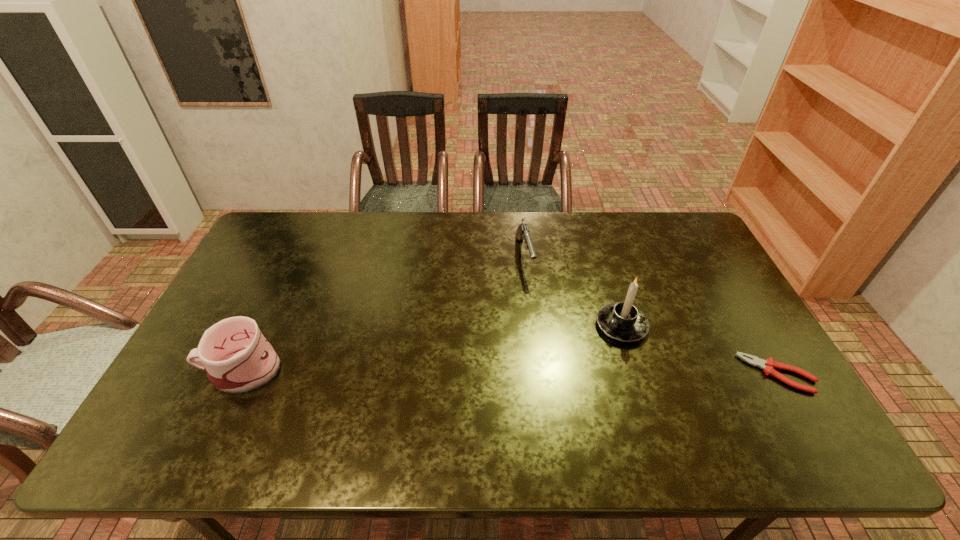
Identify the location of vacant space on the desktop that is between the second tallest object and the rightmost object and is positioned with a handle on the side of the third object from left to right. (558, 372).

The width and height of the screenshot is (960, 540). Find the location of `vacant spot on the desktop that is between the mug and the rightmost object and is positioned aiming along the barrel of the second object from left to right`. vacant spot on the desktop that is between the mug and the rightmost object and is positioned aiming along the barrel of the second object from left to right is located at coordinates (557, 372).